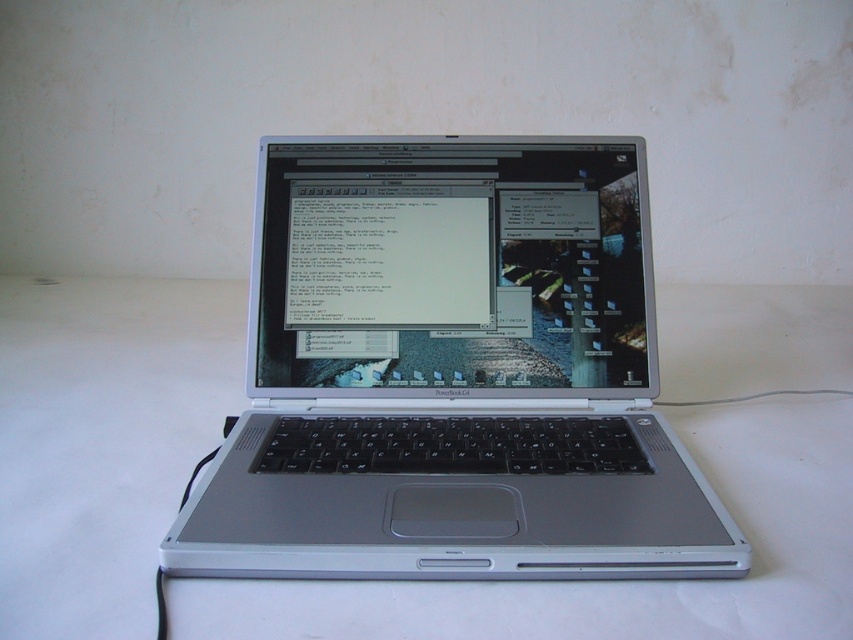
You are a technician who needs to place a 8 inch wide tool box between the silver metallic laptop at center and the white matte table at center. Can you fit it there?

The distance between the silver metallic laptop at center and the white matte table at center is 7.86 inches, which is slightly less than the 8 inch width of the tool box. Therefore, the tool box cannot fit in the space between them.